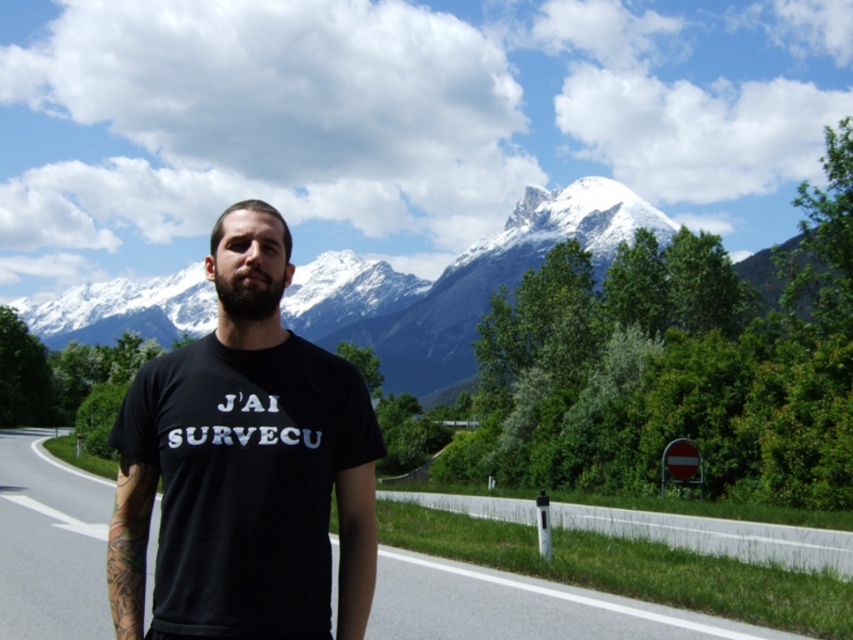
You are a photographer trying to capture the scenic mountain view. You notice the dark brown fuzzy beard at center and the black asphalt road at center in your frame. Which object should you adjust your camera to focus on to ensure the mountain backdrop is clearly visible?

The dark brown fuzzy beard at center is behind the black asphalt road at center, so focusing on the black asphalt road at center will keep the mountain backdrop in focus.